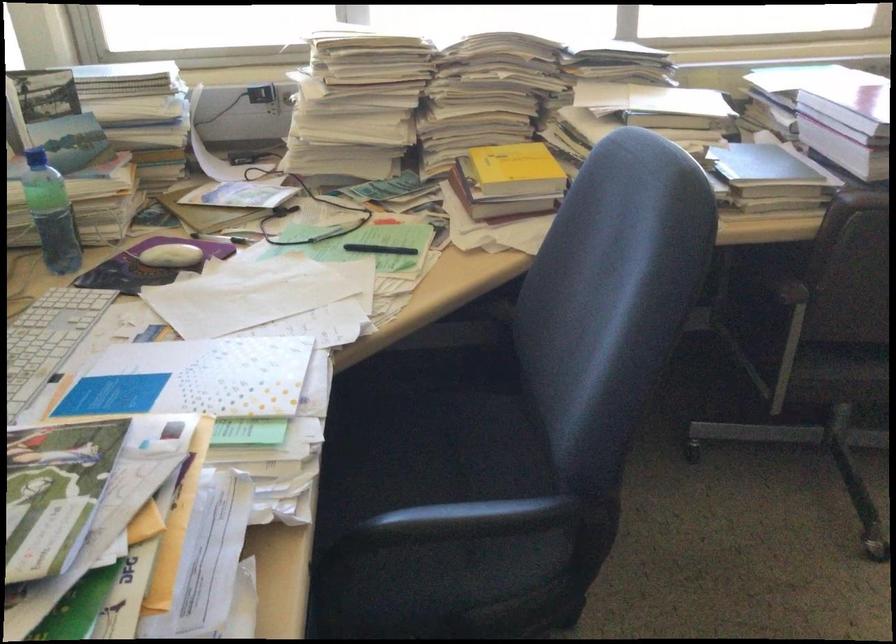
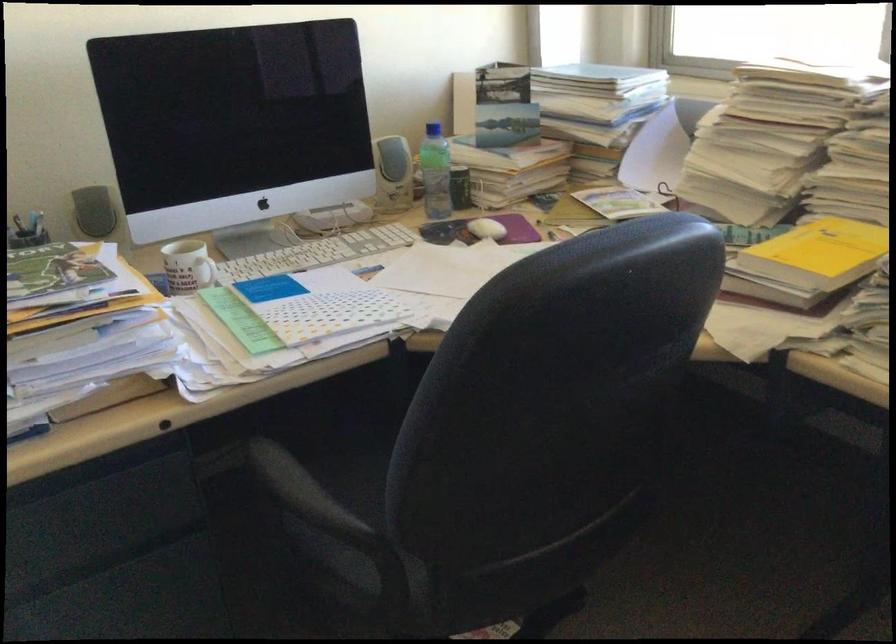
Locate, in the second image, the point that corresponds to pixel 529 167 in the first image.

(819, 252)